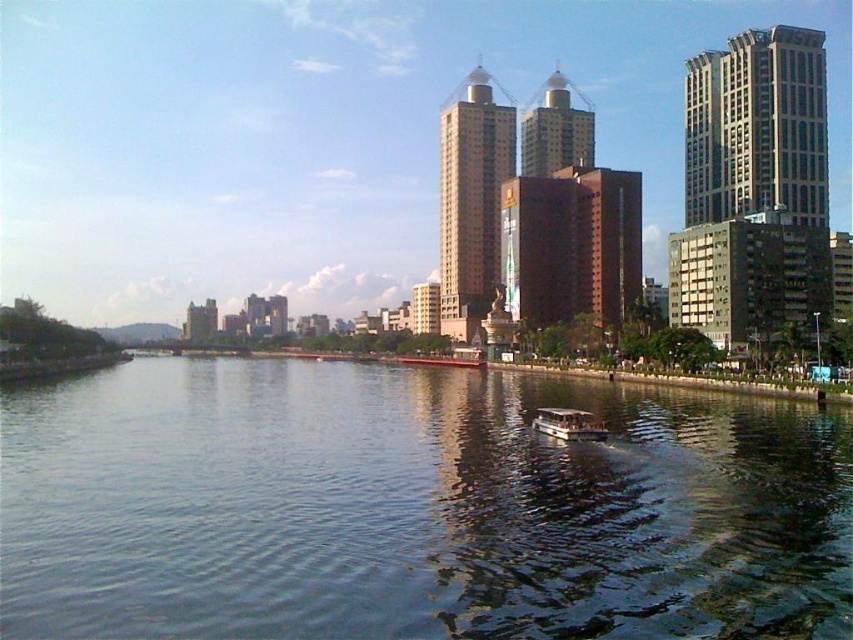
Between green reflective water at center and metallic silver boat at center, which one appears on the right side from the viewer's perspective?

metallic silver boat at center

Does point (589, 550) come farther from viewer compared to point (572, 410)?

No, (589, 550) is closer to viewer.

Where is `green reflective water at center`? The image size is (853, 640). green reflective water at center is located at coordinates (413, 508).